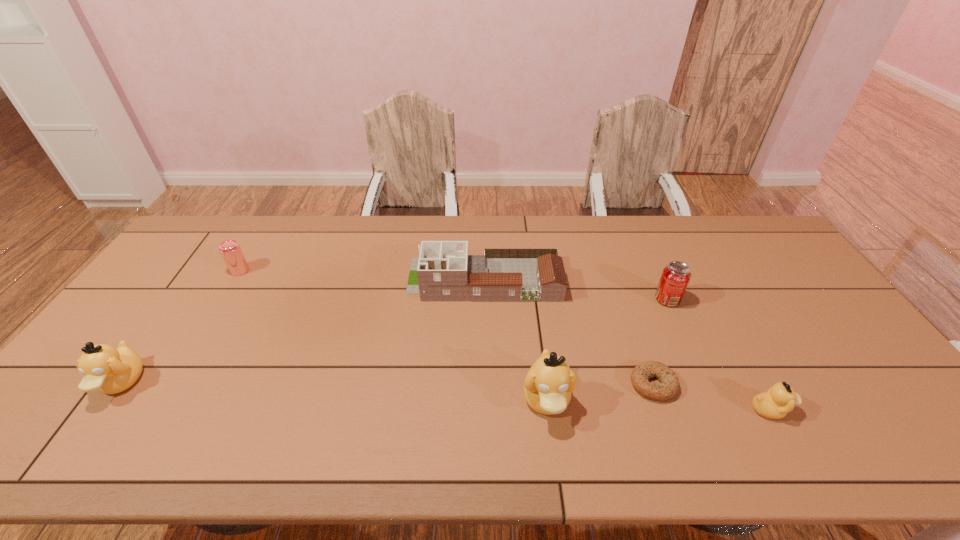
If the aim is uniform spacing by inserting an additional duckling among them, please point to a vacant space for this new duckling. Please provide its 2D coordinates. Your answer should be formatted as a tuple, i.e. [(x, y)], where the tuple contains the x and y coordinates of a point satisfying the conditions above.

[(330, 391)]